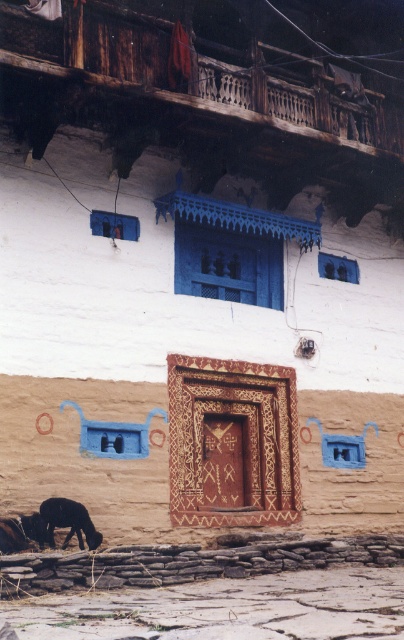
Who is more distant from viewer, (x=206, y=132) or (x=23, y=520)?

Point (x=206, y=132)

Which is below, wooden balcony at upper center or black fur dog at lower left?

black fur dog at lower left is lower down.

The width and height of the screenshot is (404, 640). Describe the element at coordinates (214, 67) in the screenshot. I see `wooden balcony at upper center` at that location.

This screenshot has height=640, width=404. Find the location of `wooden balcony at upper center`. wooden balcony at upper center is located at coordinates (214, 67).

I want to click on wooden balcony at upper center, so pos(214,67).

Which is in front, point (260, 92) or point (56, 522)?

Positioned in front is point (56, 522).

The image size is (404, 640). What are the coordinates of `wooden balcony at upper center` in the screenshot? It's located at (214, 67).

Which is below, black fur goat at lower left or black fur dog at lower left?

black fur dog at lower left

What are the coordinates of `black fur goat at lower left` in the screenshot? It's located at (69, 522).